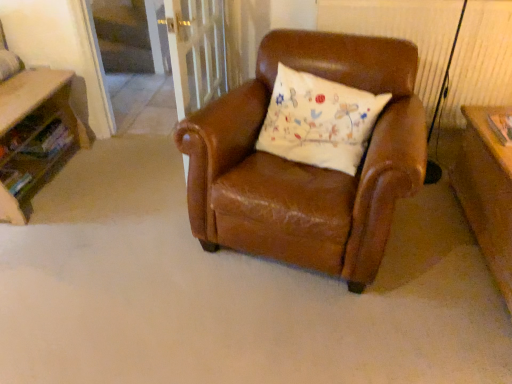
Identify the location of vacant area that is in front of wooden table at left. (50, 253).